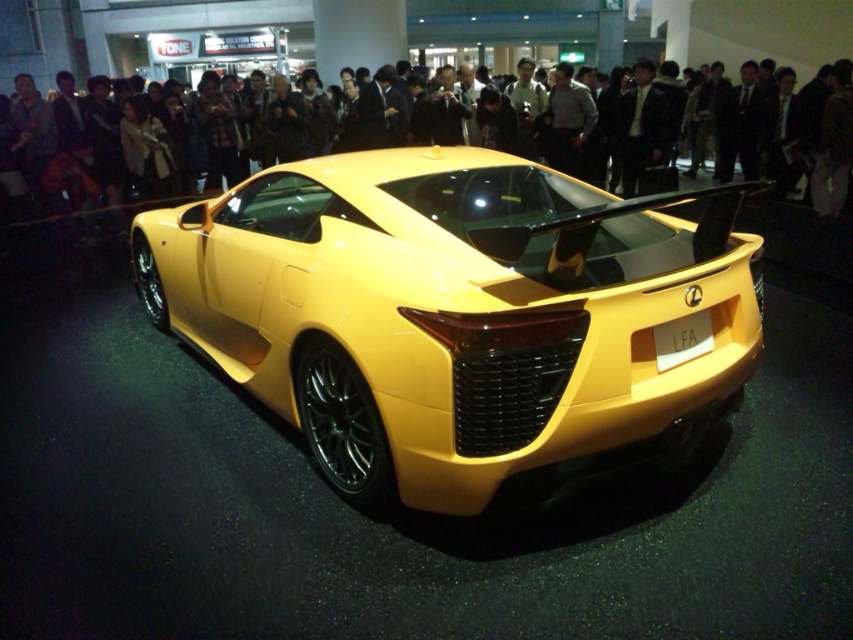
From the picture: You are standing at the point marked by the coordinates point (461, 317) in the auto show venue. What object are you directly facing?

The point (461, 317) indicates yellow matte solid car at center, so you are directly facing the yellow matte solid car at center.